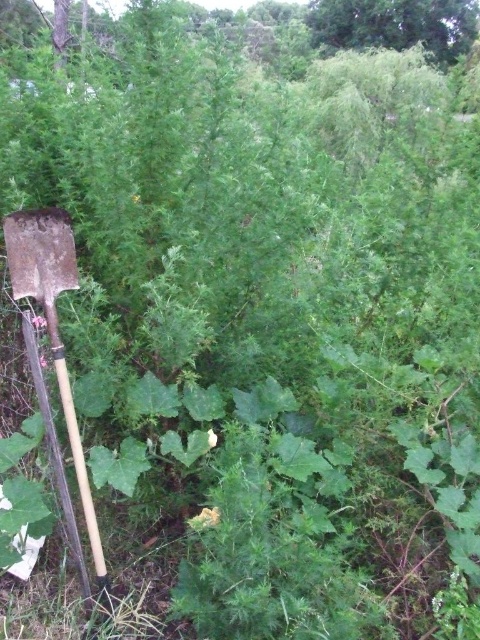
Looking at this image, is wooden shovel at left to the left of green leafy tree at upper center from the viewer's perspective?

Correct, you'll find wooden shovel at left to the left of green leafy tree at upper center.

Is point (44, 289) positioned before point (313, 4)?

Yes, it is.

Does point (74, 275) lie behind point (444, 20)?

No, (74, 275) is closer to viewer.

The image size is (480, 640). What are the coordinates of `wooden shovel at left` in the screenshot? It's located at (52, 323).